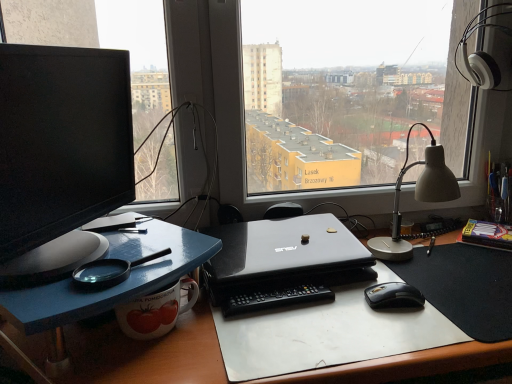
Locate an element on the screen. The height and width of the screenshot is (384, 512). vacant area to the right of matte black monitor at left is located at coordinates (158, 253).